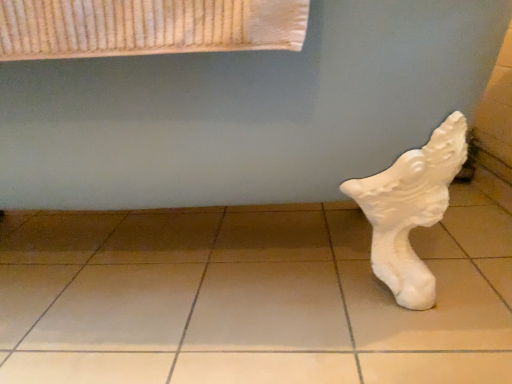
Question: Should I look upward or downward to see white matte sculpture at lower right?

Choices:
 (A) down
 (B) up

Answer: (B)

Question: Could white matte sculpture at lower right be considered to be inside white matte tile at lower right?

Choices:
 (A) yes
 (B) no

Answer: (B)

Question: Is white matte tile at lower right oriented away from white matte sculpture at lower right?

Choices:
 (A) yes
 (B) no

Answer: (B)

Question: From a real-world perspective, is white matte tile at lower right positioned over white matte sculpture at lower right based on gravity?

Choices:
 (A) no
 (B) yes

Answer: (A)

Question: From a real-world perspective, is white matte tile at lower right beneath white matte sculpture at lower right?

Choices:
 (A) yes
 (B) no

Answer: (A)

Question: Is white matte tile at lower right aimed at white matte sculpture at lower right?

Choices:
 (A) no
 (B) yes

Answer: (A)

Question: Would you consider white matte tile at lower right to be distant from white matte sculpture at lower right?

Choices:
 (A) yes
 (B) no

Answer: (B)

Question: From a real-world perspective, is white matte sculpture at lower right beneath white matte tile at lower right?

Choices:
 (A) no
 (B) yes

Answer: (A)

Question: Is white matte sculpture at lower right oriented towards white matte tile at lower right?

Choices:
 (A) yes
 (B) no

Answer: (B)

Question: From the image's perspective, is white matte sculpture at lower right on white matte tile at lower right?

Choices:
 (A) no
 (B) yes

Answer: (B)

Question: Is white matte tile at lower right located within white matte sculpture at lower right?

Choices:
 (A) no
 (B) yes

Answer: (A)

Question: Is white matte sculpture at lower right smaller than white matte tile at lower right?

Choices:
 (A) no
 (B) yes

Answer: (A)

Question: Is white matte sculpture at lower right bigger than white matte tile at lower right?

Choices:
 (A) no
 (B) yes

Answer: (B)

Question: Would you say white matte sculpture at lower right is inside or outside white matte tile at lower right?

Choices:
 (A) outside
 (B) inside

Answer: (A)